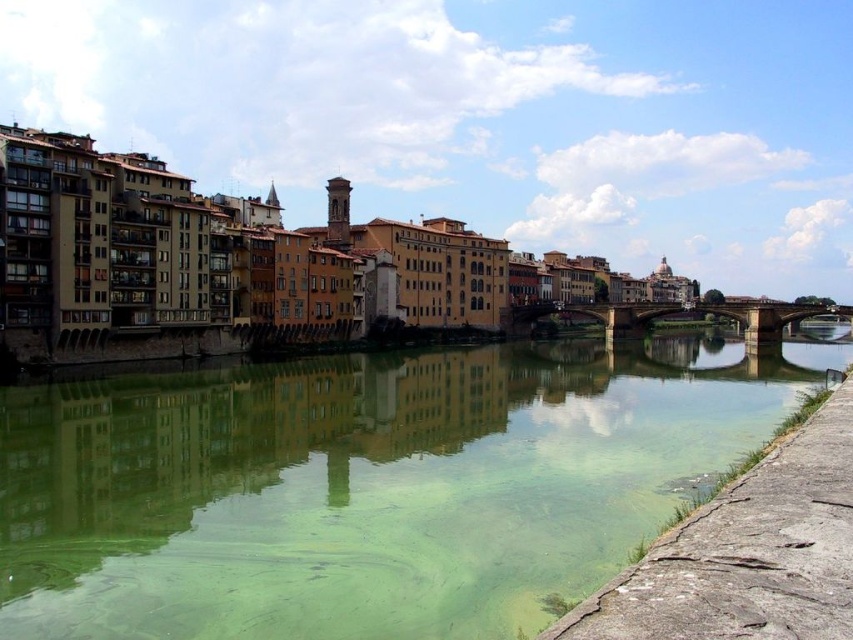
Question: Is green translucent water at lower center below stone bridge at center?

Choices:
 (A) yes
 (B) no

Answer: (A)

Question: Which point is farther from the camera taking this photo?

Choices:
 (A) (613, 333)
 (B) (561, 484)

Answer: (A)

Question: Can you confirm if green translucent water at lower center is positioned above stone bridge at center?

Choices:
 (A) no
 (B) yes

Answer: (A)

Question: Considering the relative positions of green translucent water at lower center and stone bridge at center in the image provided, where is green translucent water at lower center located with respect to stone bridge at center?

Choices:
 (A) left
 (B) right

Answer: (A)